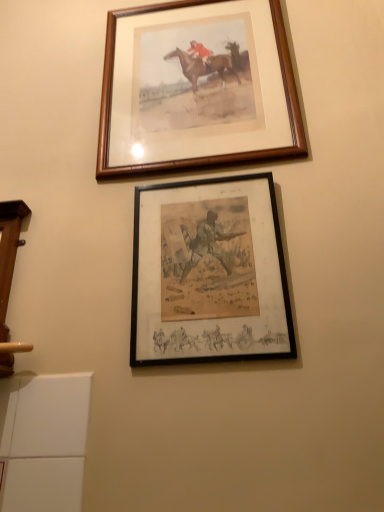
Question: Should I look upward or downward to see black matte picture frame at center, which ranks as the 1th picture frame in bottom-to-top order?

Choices:
 (A) down
 (B) up

Answer: (A)

Question: Should I look upward or downward to see wooden frame at upper center, acting as the 1th picture frame starting from the top?

Choices:
 (A) down
 (B) up

Answer: (B)

Question: Can you confirm if black matte picture frame at center, which ranks as the 1th picture frame in bottom-to-top order, is taller than wooden frame at upper center, positioned as the 2th picture frame in front-to-back order?

Choices:
 (A) yes
 (B) no

Answer: (B)

Question: Is black matte picture frame at center, acting as the second picture frame starting from the back, positioned beyond the bounds of wooden frame at upper center, placed as the 2th picture frame when sorted from bottom to top?

Choices:
 (A) no
 (B) yes

Answer: (B)

Question: From a real-world perspective, is black matte picture frame at center, which is the 2th picture frame in top-to-bottom order, on top of wooden frame at upper center, the first picture frame viewed from the back?

Choices:
 (A) no
 (B) yes

Answer: (A)

Question: Is black matte picture frame at center, which ranks as the 1th picture frame in bottom-to-top order, positioned far away from wooden frame at upper center, acting as the 1th picture frame starting from the top?

Choices:
 (A) no
 (B) yes

Answer: (A)

Question: Is black matte picture frame at center, the 1th picture frame positioned from the front, aimed at wooden frame at upper center, the first picture frame viewed from the back?

Choices:
 (A) yes
 (B) no

Answer: (B)

Question: Is black matte picture frame at center, acting as the second picture frame starting from the back, placed right next to wooden frame at upper center, placed as the 2th picture frame when sorted from bottom to top?

Choices:
 (A) yes
 (B) no

Answer: (B)

Question: Can you confirm if wooden frame at upper center, the first picture frame viewed from the back, is shorter than black matte picture frame at center, which is the 2th picture frame in top-to-bottom order?

Choices:
 (A) no
 (B) yes

Answer: (A)

Question: Is wooden frame at upper center, placed as the 2th picture frame when sorted from bottom to top, aimed at black matte picture frame at center, which is the 2th picture frame in top-to-bottom order?

Choices:
 (A) no
 (B) yes

Answer: (A)

Question: Is wooden frame at upper center, placed as the 2th picture frame when sorted from bottom to top, closer to the viewer compared to black matte picture frame at center, acting as the second picture frame starting from the back?

Choices:
 (A) yes
 (B) no

Answer: (B)

Question: From the image's perspective, does wooden frame at upper center, acting as the 1th picture frame starting from the top, appear lower than black matte picture frame at center, acting as the second picture frame starting from the back?

Choices:
 (A) yes
 (B) no

Answer: (B)

Question: From the image's perspective, does wooden frame at upper center, the first picture frame viewed from the back, appear higher than black matte picture frame at center, acting as the second picture frame starting from the back?

Choices:
 (A) yes
 (B) no

Answer: (A)

Question: From a real-world perspective, is wooden frame at upper center, the first picture frame viewed from the back, physically below black matte picture frame at center, acting as the second picture frame starting from the back?

Choices:
 (A) yes
 (B) no

Answer: (B)

Question: From a real-world perspective, relative to black matte picture frame at center, acting as the second picture frame starting from the back, is wooden frame at upper center, the first picture frame viewed from the back, vertically above or below?

Choices:
 (A) above
 (B) below

Answer: (A)